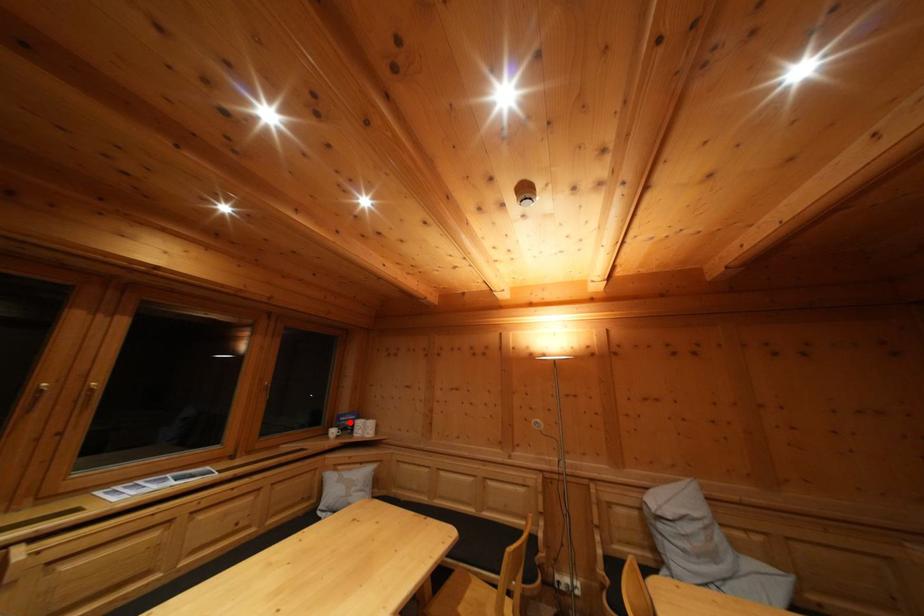
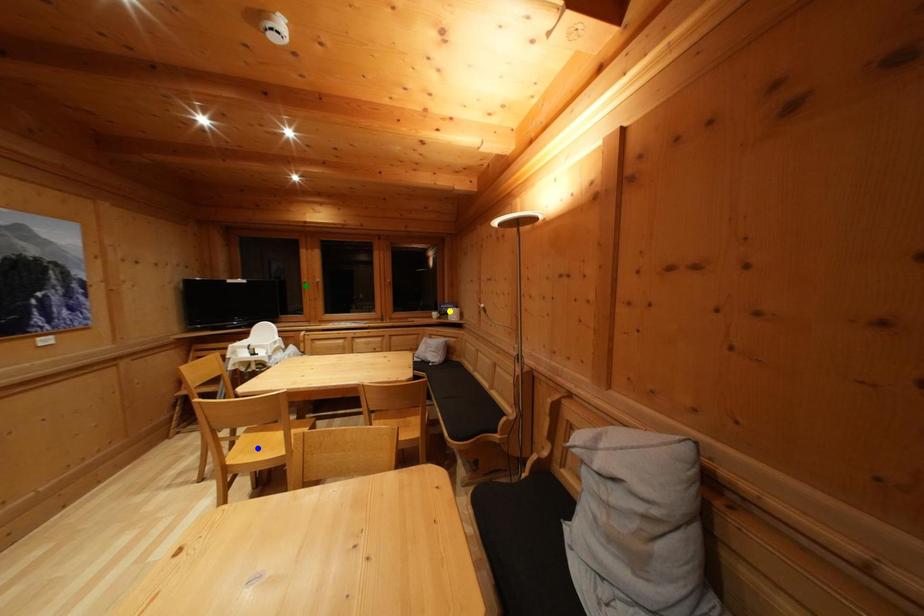
Question: I am providing you with two images of the same scene from different viewpoints. A red point is marked on the first image. You are given multiple points on the second image. Can you choose the point in image 2 that corresponds to the point in image 1?

Choices:
 (A) green point
 (B) blue point
 (C) yellow point

Answer: (C)